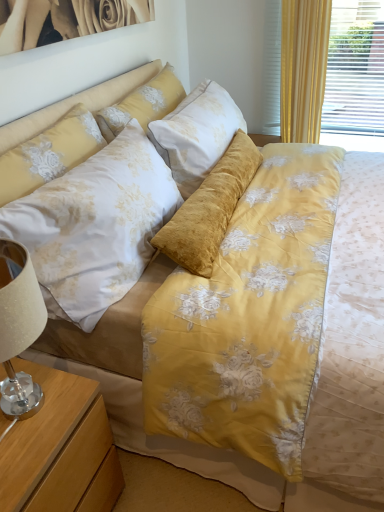
Question: Considering the positions of floral fabric pillow at upper center, which is the 2th pillow in front-to-back order, and wooden nightstand at lower left in the image, is floral fabric pillow at upper center, which is the 2th pillow in front-to-back order, bigger or smaller than wooden nightstand at lower left?

Choices:
 (A) small
 (B) big

Answer: (A)

Question: From a real-world perspective, is floral fabric pillow at upper center, which is the 2th pillow in front-to-back order, physically located above or below wooden nightstand at lower left?

Choices:
 (A) below
 (B) above

Answer: (B)

Question: Which object is positioned closest to the white glossy picture frame at upper left?

Choices:
 (A) floral satin pillow at upper left, placed as the 2th pillow when sorted from back to front
 (B) floral fabric pillow at upper center, positioned as the 1th pillow in back-to-front order
 (C) wooden nightstand at lower left

Answer: (B)

Question: Which of these objects is positioned closest to the white glossy picture frame at upper left?

Choices:
 (A) floral satin pillow at upper left, the 1th pillow from the front
 (B) floral fabric pillow at upper center, which is the 2th pillow in front-to-back order
 (C) wooden nightstand at lower left

Answer: (B)